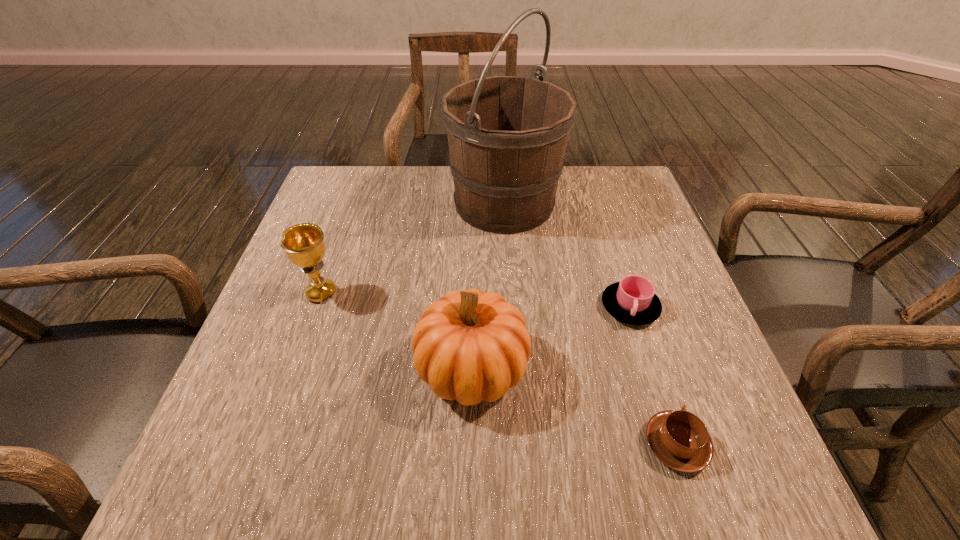
The width and height of the screenshot is (960, 540). I want to click on the tallest object, so click(507, 135).

The height and width of the screenshot is (540, 960). I want to click on bucket, so click(507, 135).

The height and width of the screenshot is (540, 960). In order to click on pumpkin in this screenshot , I will do `click(469, 346)`.

At what (x,y) coordinates should I click in order to perform the action: click on chalice. Please return your answer as a coordinate pair (x, y). Looking at the image, I should click on (304, 245).

What are the coordinates of `the leftmost object` in the screenshot? It's located at (304, 245).

The width and height of the screenshot is (960, 540). Find the location of `cup`. cup is located at coordinates (633, 300).

Image resolution: width=960 pixels, height=540 pixels. I want to click on cappuccino, so click(679, 439).

Where is `blank space located on the front of the tallest object`? This screenshot has height=540, width=960. blank space located on the front of the tallest object is located at coordinates (516, 371).

Identify the location of free region located on the back of the pumpkin. This screenshot has width=960, height=540. (473, 248).

Locate an element on the screen. Image resolution: width=960 pixels, height=540 pixels. free space located 0.170m on the right of the leftmost object is located at coordinates (420, 293).